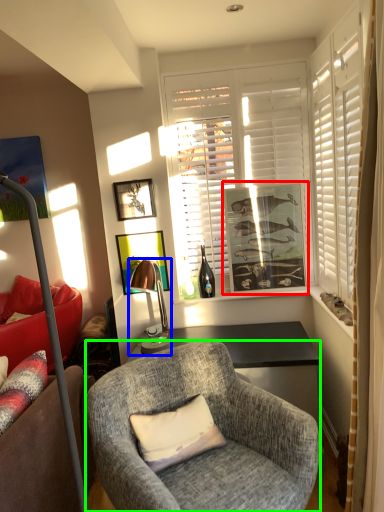
Question: Considering the real-world distances, which object is farthest from picture frame (highlighted by a red box)? lamp (highlighted by a blue box) or chair (highlighted by a green box)?

Choices:
 (A) lamp
 (B) chair

Answer: (B)